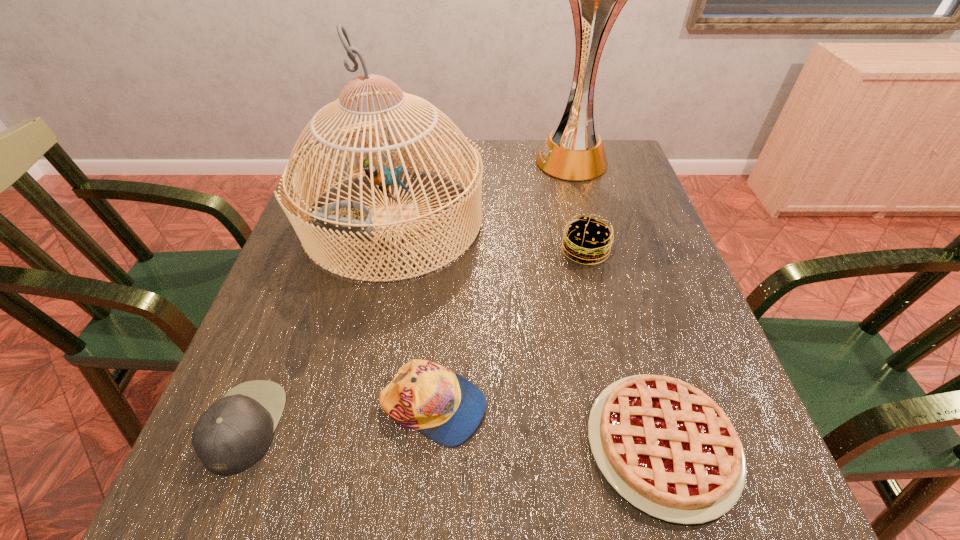
In the image, there is a desktop. Find the location of `vacant space at the near left corner`. vacant space at the near left corner is located at coordinates (253, 518).

The image size is (960, 540). I want to click on free location at the far right corner, so click(614, 164).

Locate an element on the screen. The width and height of the screenshot is (960, 540). free space that is in between the right cap and the second tallest object is located at coordinates (413, 313).

Find the location of a particular element. The height and width of the screenshot is (540, 960). empty space that is in between the patty and the right cap is located at coordinates (509, 329).

Image resolution: width=960 pixels, height=540 pixels. Find the location of `free space between the birdcage and the patty`. free space between the birdcage and the patty is located at coordinates (489, 235).

The image size is (960, 540). I want to click on vacant area that lies between the shortest object and the birdcage, so (528, 332).

Where is `vacant space in between the patty and the tallest object`? This screenshot has width=960, height=540. vacant space in between the patty and the tallest object is located at coordinates (579, 206).

Where is `vacant area between the second tallest object and the right cap`? vacant area between the second tallest object and the right cap is located at coordinates (413, 313).

You are a GUI agent. You are given a task and a screenshot of the screen. Output one action in this format:
    pyautogui.click(x=<x>, y=<y>)
    Task: Click on the free spot between the trophy and the fifth shortest object
    The height and width of the screenshot is (540, 960).
    Given the screenshot: What is the action you would take?
    pyautogui.click(x=483, y=191)

The height and width of the screenshot is (540, 960). I want to click on empty location between the third tallest object and the tallest object, so click(579, 206).